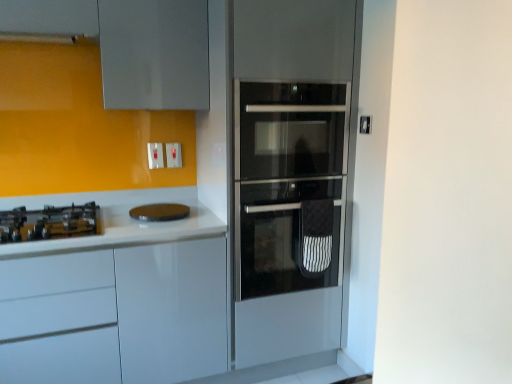
Question: From the image's perspective, is white plastic switch at upper center, the second electric outlet when ordered from left to right, under stainless steel oven at center?

Choices:
 (A) yes
 (B) no

Answer: (B)

Question: Considering the relative sizes of white plastic switch at upper center, placed as the first electric outlet when sorted from right to left, and stainless steel oven at center in the image provided, is white plastic switch at upper center, placed as the first electric outlet when sorted from right to left, bigger than stainless steel oven at center?

Choices:
 (A) yes
 (B) no

Answer: (B)

Question: Is white plastic switch at upper center, placed as the first electric outlet when sorted from right to left, beside stainless steel oven at center?

Choices:
 (A) yes
 (B) no

Answer: (B)

Question: Is white plastic switch at upper center, the second electric outlet when ordered from left to right, positioned in front of stainless steel oven at center?

Choices:
 (A) no
 (B) yes

Answer: (A)

Question: Is white plastic switch at upper center, placed as the first electric outlet when sorted from right to left, turned away from stainless steel oven at center?

Choices:
 (A) yes
 (B) no

Answer: (B)

Question: From a real-world perspective, is white plastic switch at upper center, placed as the first electric outlet when sorted from right to left, located higher than stainless steel oven at center?

Choices:
 (A) yes
 (B) no

Answer: (A)

Question: Does white plastic switch at upper center, which is counted as the 1th electric outlet, starting from the left, appear on the right side of yellow matte gas stove at left?

Choices:
 (A) yes
 (B) no

Answer: (A)

Question: Is white plastic switch at upper center, acting as the second electric outlet starting from the right, further to camera compared to yellow matte gas stove at left?

Choices:
 (A) yes
 (B) no

Answer: (A)

Question: From a real-world perspective, is white plastic switch at upper center, which is counted as the 1th electric outlet, starting from the left, positioned over yellow matte gas stove at left based on gravity?

Choices:
 (A) yes
 (B) no

Answer: (A)

Question: Is the depth of white plastic switch at upper center, acting as the second electric outlet starting from the right, less than that of yellow matte gas stove at left?

Choices:
 (A) no
 (B) yes

Answer: (A)

Question: Can yellow matte gas stove at left be found inside white plastic switch at upper center, which is counted as the 1th electric outlet, starting from the left?

Choices:
 (A) yes
 (B) no

Answer: (B)

Question: Are white plastic switch at upper center, which is counted as the 1th electric outlet, starting from the left, and yellow matte gas stove at left making contact?

Choices:
 (A) yes
 (B) no

Answer: (B)

Question: Does brown matte cutting board at center have a larger size compared to white plastic switch at upper center, which is counted as the 1th electric outlet, starting from the left?

Choices:
 (A) no
 (B) yes

Answer: (B)